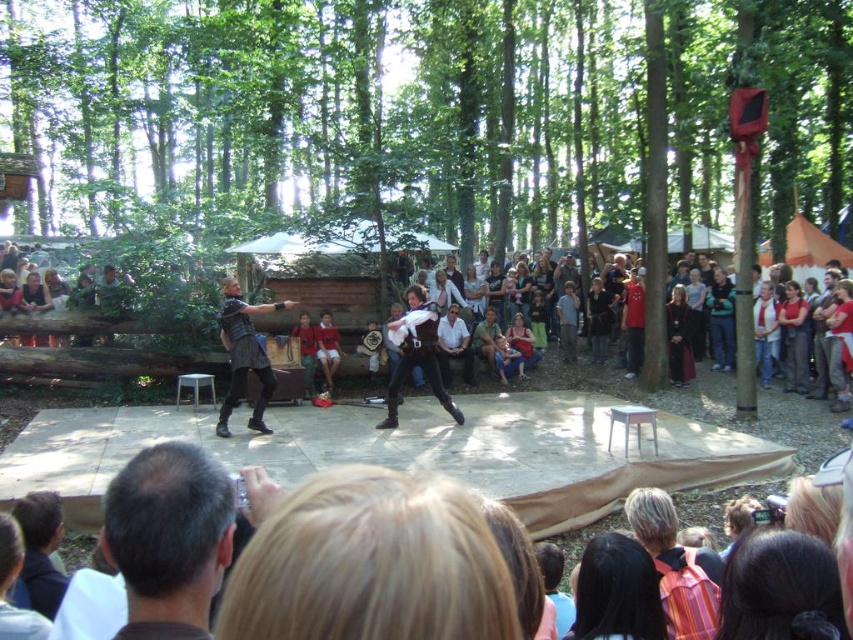
Question: Can you confirm if striped fabric shirt at lower right is thinner than dark blue shirt at right?

Choices:
 (A) yes
 (B) no

Answer: (B)

Question: Among these points, which one is nearest to the camera?

Choices:
 (A) (460, 358)
 (B) (674, 384)
 (C) (300, 340)
 (D) (564, 340)

Answer: (C)

Question: Does striped fabric shirt at lower right appear over light blue shirt at center?

Choices:
 (A) yes
 (B) no

Answer: (B)

Question: Which point is farther to the camera?

Choices:
 (A) red striped shirt at center
 (B) leather armor at center

Answer: (A)

Question: Which point is closer to the camera?

Choices:
 (A) denim jacket at center
 (B) leather armor at center

Answer: (B)

Question: Can you confirm if dark brown hair at lower left is bigger than dark blue shirt at right?

Choices:
 (A) no
 (B) yes

Answer: (A)